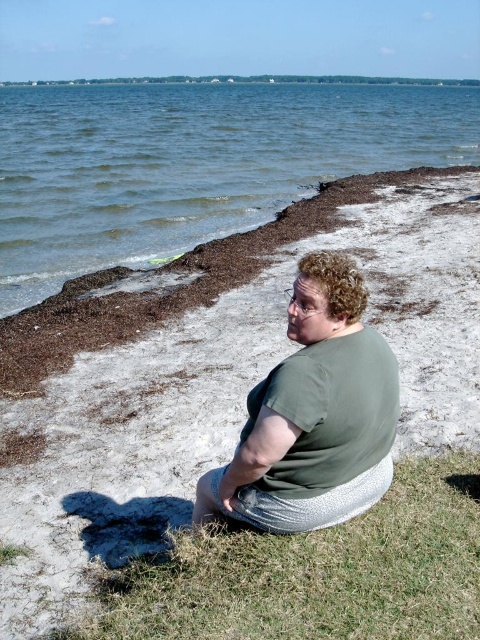
Question: Which object is positioned closest to the green grass at lower center?

Choices:
 (A) brown sandy beach at lower left
 (B) green fabric shirt at center

Answer: (B)

Question: Does brown sandy beach at lower left appear on the left side of green fabric shirt at center?

Choices:
 (A) yes
 (B) no

Answer: (A)

Question: Which point appears farthest from the camera in this image?

Choices:
 (A) (173, 186)
 (B) (409, 356)
 (C) (334, 410)
 (D) (396, 600)

Answer: (A)

Question: Which point is closer to the camera taking this photo?

Choices:
 (A) (67, 214)
 (B) (419, 522)
 (C) (309, 349)
 (D) (72, 504)

Answer: (C)

Question: Can you confirm if blue water at upper center is positioned above green fabric shirt at center?

Choices:
 (A) yes
 (B) no

Answer: (A)

Question: Does green grass at lower center come in front of green fabric shirt at center?

Choices:
 (A) no
 (B) yes

Answer: (B)